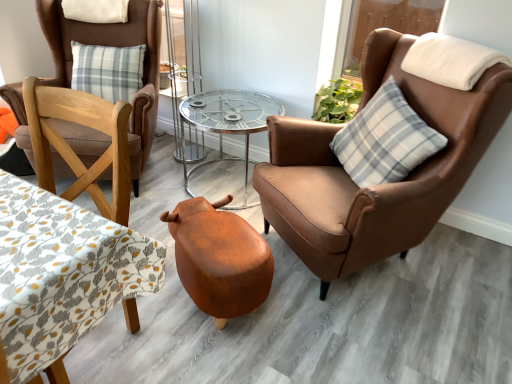
Question: In terms of size, does brown leather chair at left, which is counted as the second chair, starting from the right, appear bigger or smaller than leather-like stool at center?

Choices:
 (A) small
 (B) big

Answer: (B)

Question: Relative to leather-like stool at center, is brown leather chair at left, acting as the first chair starting from the left, in front or behind?

Choices:
 (A) front
 (B) behind

Answer: (B)

Question: Which of these objects is positioned farthest from the brown leather chair at left, which is counted as the second chair, starting from the right?

Choices:
 (A) patterned fabric table at left
 (B) clear glass table at center
 (C) white fleece pillow at upper right, the first pillow viewed from the right
 (D) brown leather chair at right, positioned as the 1th chair in right-to-left order
 (E) leather-like stool at center

Answer: (C)

Question: Which object is positioned farthest from the brown leather chair at right, positioned as the 1th chair in right-to-left order?

Choices:
 (A) white soft pillow at upper left, the 3th pillow in the right-to-left sequence
 (B) clear glass table at center
 (C) white plaid pillow at upper right, which ranks as the first pillow in bottom-to-top order
 (D) patterned fabric table at left
 (E) white fleece pillow at upper right, the third pillow when ordered from left to right

Answer: (A)